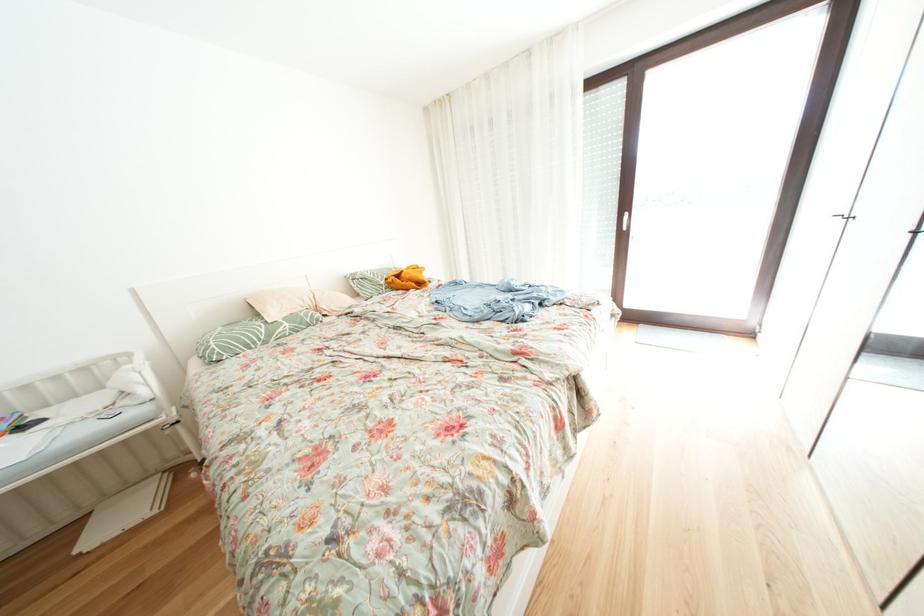
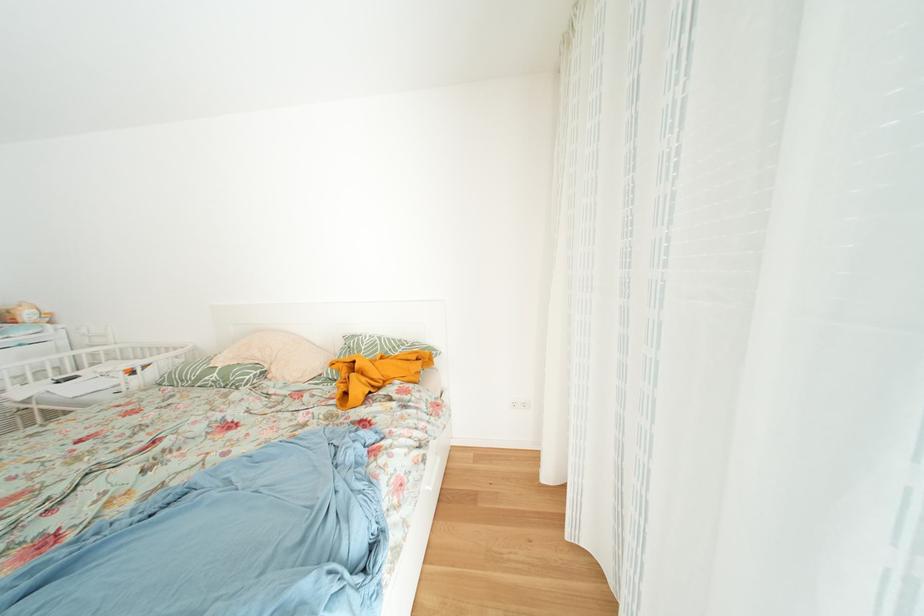
Find the pixel in the second image that matches (x=278, y=339) in the first image.

(208, 384)